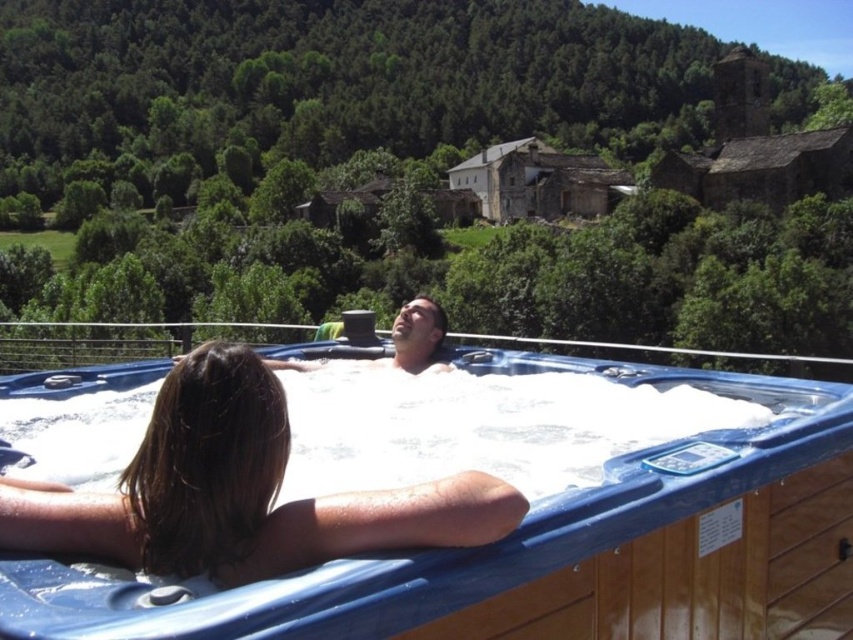
You are designing a new hot tub cover that needs to fit over the white foamy water at center and the matte blue hot tub at center. Since the cover must be wider than both, which object determines the minimum width required for the cover?

The white foamy water at center determines the minimum width required for the cover because its width surpasses that of the matte blue hot tub at center.